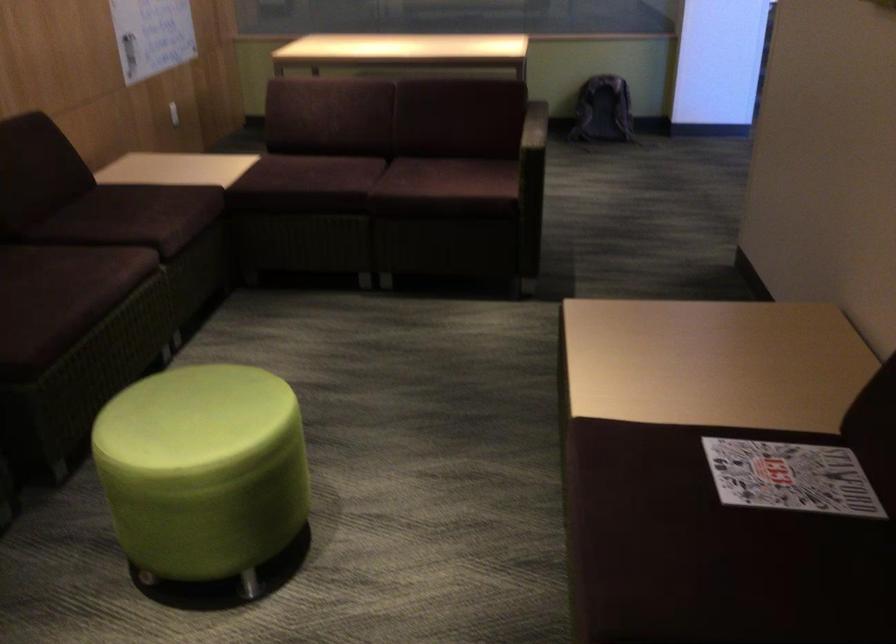
Find where to lean the sofa armrest. Please return your answer as a coordinate pair (x, y).

(533, 138)